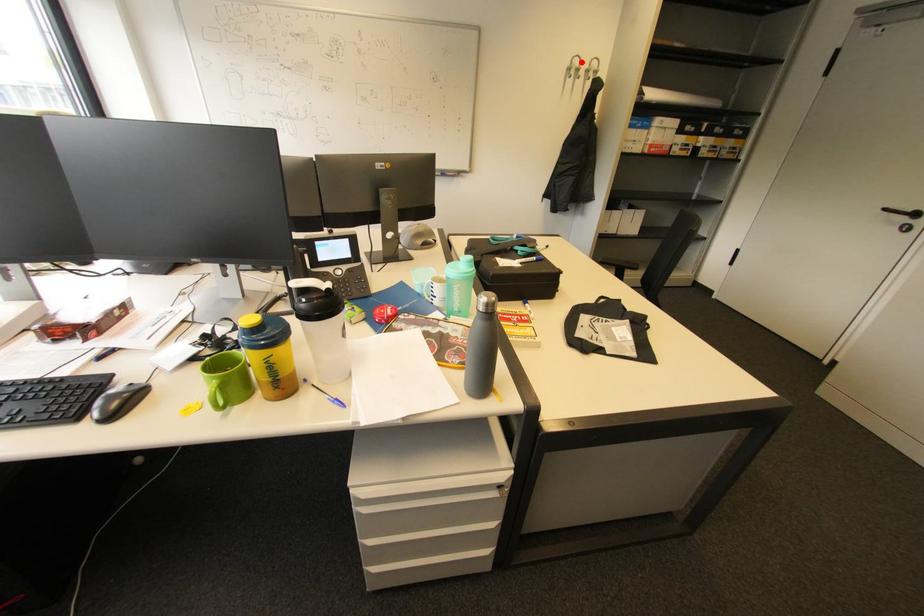
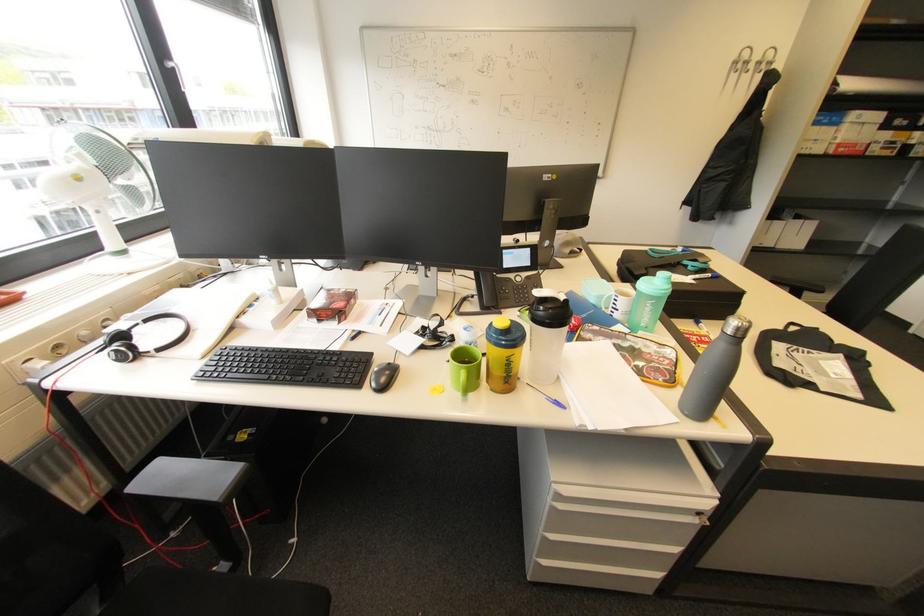
Question: I am providing you with two images of the same scene from different viewpoints. Image1 has a red point marked. In image2, the corresponding 3D location appears at what relative position? Reply with the corresponding letter.

Choices:
 (A) Closer
 (B) Farther

Answer: (B)